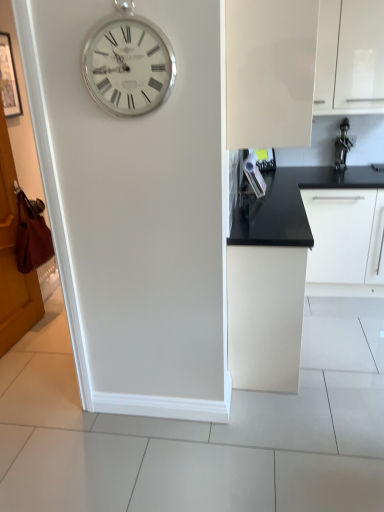
Question: Is matte white cabinet at center, the third cabinetry from the top, outside of silver metallic clock at upper left?

Choices:
 (A) yes
 (B) no

Answer: (A)

Question: Considering the relative sizes of matte white cabinet at center, which appears as the 1th cabinetry when ordered from the bottom, and silver metallic clock at upper left in the image provided, is matte white cabinet at center, which appears as the 1th cabinetry when ordered from the bottom, bigger than silver metallic clock at upper left?

Choices:
 (A) yes
 (B) no

Answer: (A)

Question: Does matte white cabinet at center, which appears as the 1th cabinetry when ordered from the bottom, turn towards silver metallic clock at upper left?

Choices:
 (A) no
 (B) yes

Answer: (A)

Question: Can silver metallic clock at upper left be found inside matte white cabinet at center, which appears as the 1th cabinetry when ordered from the bottom?

Choices:
 (A) yes
 (B) no

Answer: (B)

Question: Is the position of matte white cabinet at center, the third cabinetry from the top, more distant than that of silver metallic clock at upper left?

Choices:
 (A) no
 (B) yes

Answer: (B)

Question: Is matte white cabinet at center, which appears as the 1th cabinetry when ordered from the bottom, wider than silver metallic clock at upper left?

Choices:
 (A) no
 (B) yes

Answer: (B)

Question: Can you confirm if glossy white cabinet at upper right, acting as the second cabinetry starting from the bottom, is wider than brown wooden door at left?

Choices:
 (A) no
 (B) yes

Answer: (B)

Question: Is glossy white cabinet at upper right, acting as the second cabinetry starting from the bottom, taller than brown wooden door at left?

Choices:
 (A) yes
 (B) no

Answer: (B)

Question: Can you confirm if glossy white cabinet at upper right, which ranks as the 2th cabinetry in top-to-bottom order, is shorter than brown wooden door at left?

Choices:
 (A) yes
 (B) no

Answer: (A)

Question: Could you tell me if glossy white cabinet at upper right, acting as the second cabinetry starting from the bottom, is turned towards brown wooden door at left?

Choices:
 (A) yes
 (B) no

Answer: (B)

Question: Is glossy white cabinet at upper right, acting as the second cabinetry starting from the bottom, facing away from brown wooden door at left?

Choices:
 (A) no
 (B) yes

Answer: (A)

Question: From a real-world perspective, does glossy white cabinet at upper right, acting as the second cabinetry starting from the bottom, stand above brown wooden door at left?

Choices:
 (A) yes
 (B) no

Answer: (A)

Question: Is white glossy cabinet at upper right, the third cabinetry from the bottom, positioned far away from glossy white cabinet at upper right, acting as the second cabinetry starting from the bottom?

Choices:
 (A) yes
 (B) no

Answer: (A)